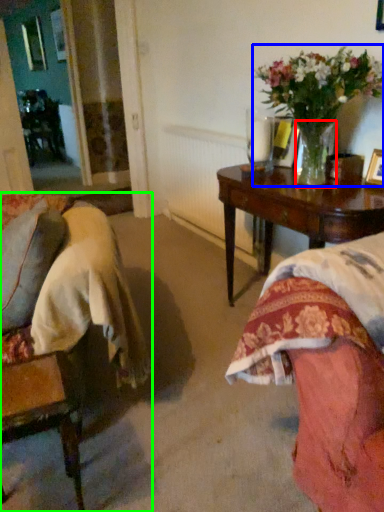
Question: Estimate the real-world distances between objects in this image. Which object is farther from vase (highlighted by a red box), houseplant (highlighted by a blue box) or chair (highlighted by a green box)?

Choices:
 (A) houseplant
 (B) chair

Answer: (B)